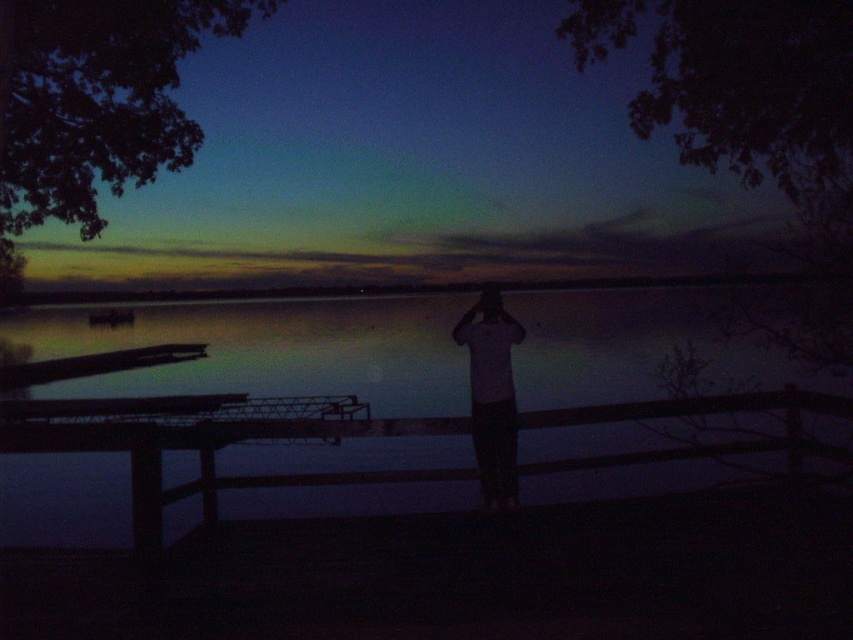
You are standing at the wooden railing in the foreground. You want to take a photo of the water at the center of the image. Is the transparent water at center directly in front of you or to one side?

The transparent water at center is located at point (241,419), which means it is positioned to the right and slightly above the center of the image. Therefore, it would be to your right side relative to your position at the railing.